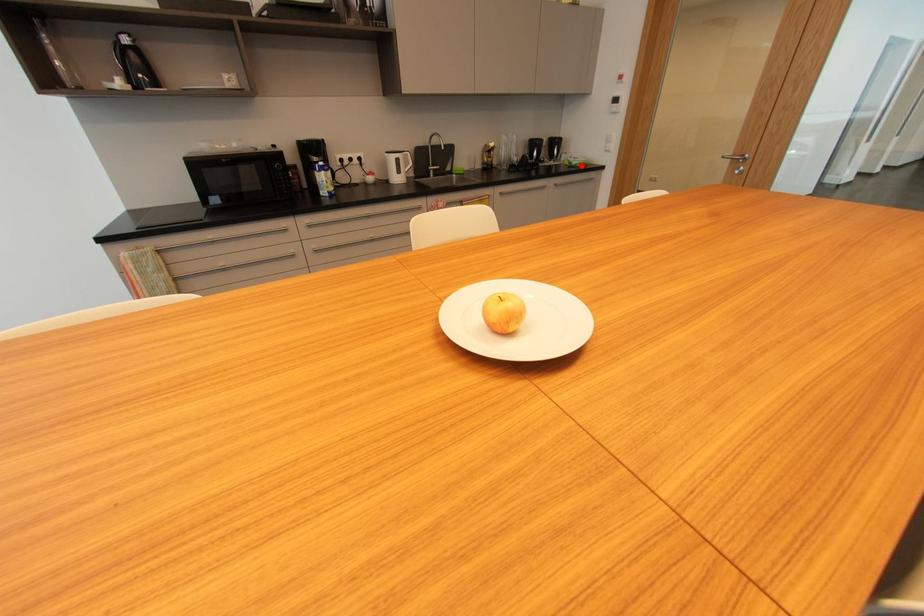
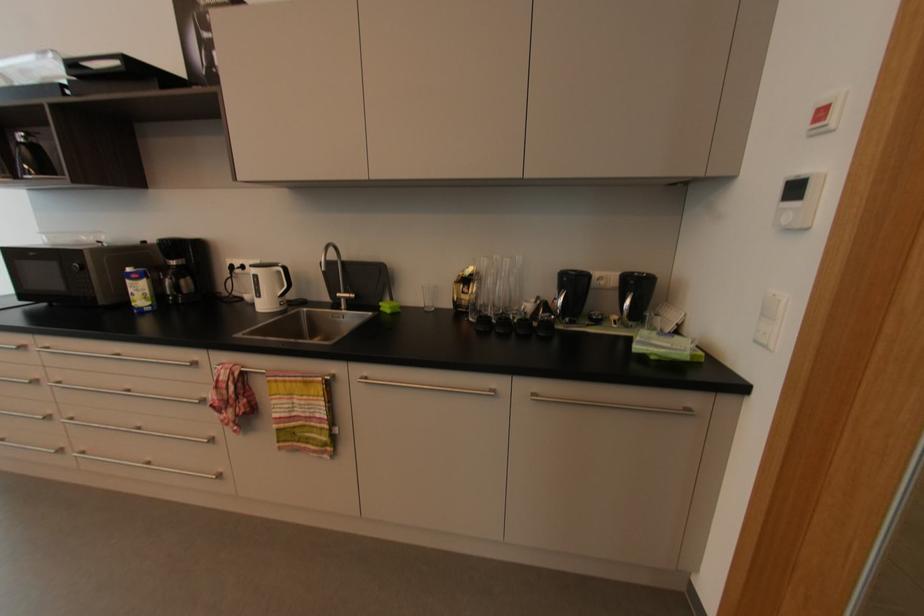
The point at the highlighted location is marked in the first image. Where is the corresponding point in the second image?

(657, 358)